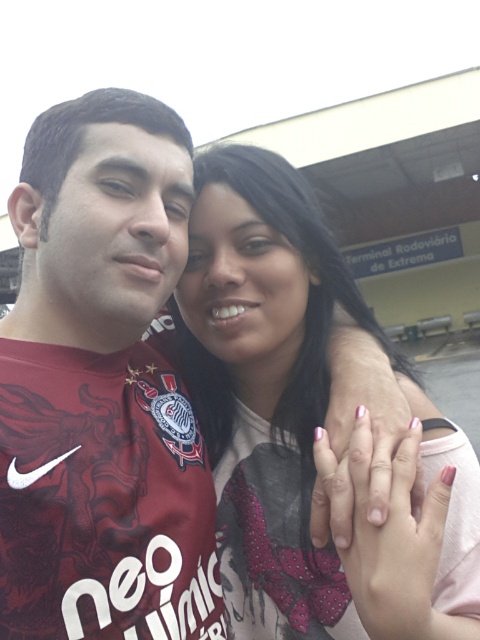
Question: Which of the following is the closest to the observer?

Choices:
 (A) (441, 556)
 (B) (39, 529)

Answer: (B)

Question: Is maroon jersey at left below matte pink shirt at center?

Choices:
 (A) yes
 (B) no

Answer: (A)

Question: Is maroon jersey at left above matte pink shirt at center?

Choices:
 (A) no
 (B) yes

Answer: (A)

Question: Among these objects, which one is farthest from the camera?

Choices:
 (A) maroon jersey at left
 (B) matte pink shirt at center

Answer: (A)

Question: Observing the image, what is the correct spatial positioning of maroon jersey at left in reference to matte pink shirt at center?

Choices:
 (A) above
 (B) below

Answer: (B)

Question: Which point is farther to the camera?

Choices:
 (A) (x=456, y=493)
 (B) (x=40, y=212)

Answer: (B)